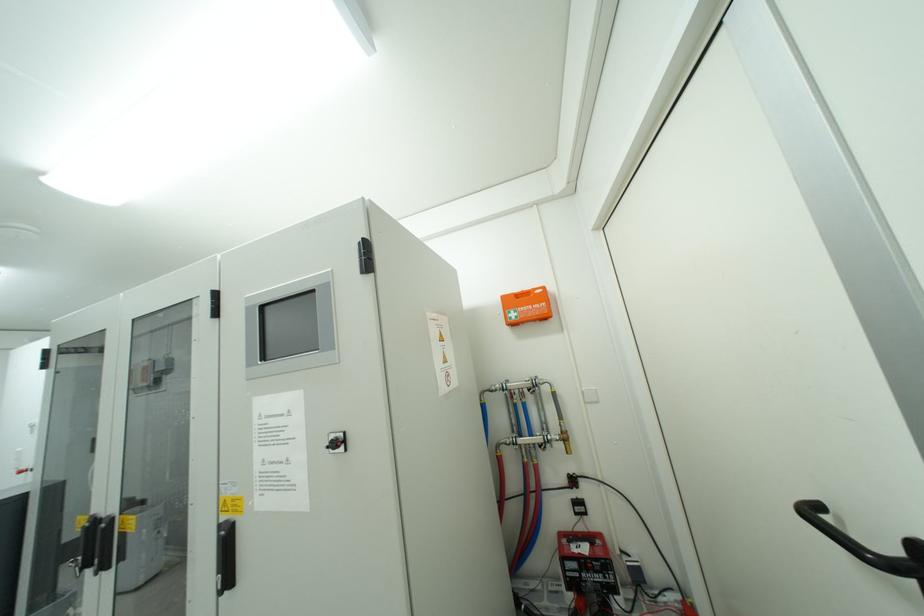
Image resolution: width=924 pixels, height=616 pixels. Describe the element at coordinates (590, 395) in the screenshot. I see `the white light switch` at that location.